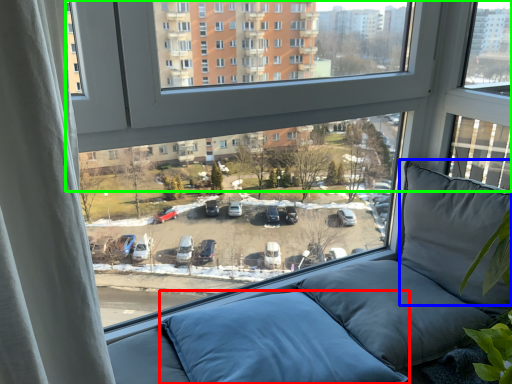
Question: Based on their relative distances, which object is nearer to pillow (highlighted by a red box)? Choose from pillow (highlighted by a blue box) and window (highlighted by a green box).

Choices:
 (A) pillow
 (B) window

Answer: (A)